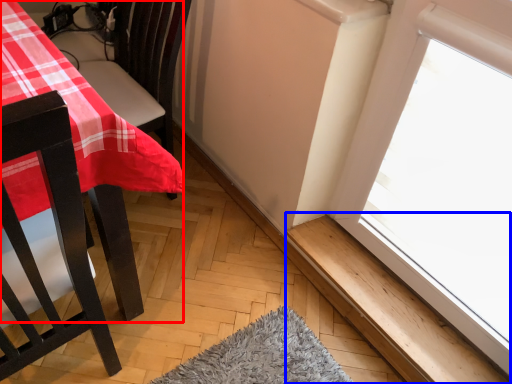
Question: Which object is closer to the camera taking this photo, table (highlighted by a red box) or window sill (highlighted by a blue box)?

Choices:
 (A) table
 (B) window sill

Answer: (A)